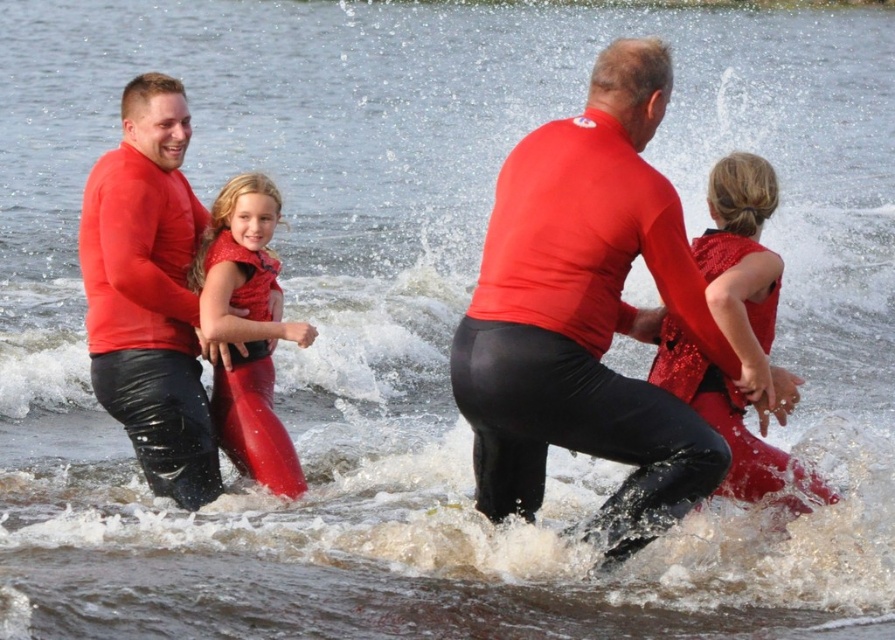
Consider the image. You are a photographer trying to capture a clear image of both the shiny sequined vest at center and the shiny red wetsuit at center. Since both are at the center, which one might be closer to the camera based on their sizes?

The shiny sequined vest at center is larger in size than the shiny red wetsuit at center, so it is closer to the camera.